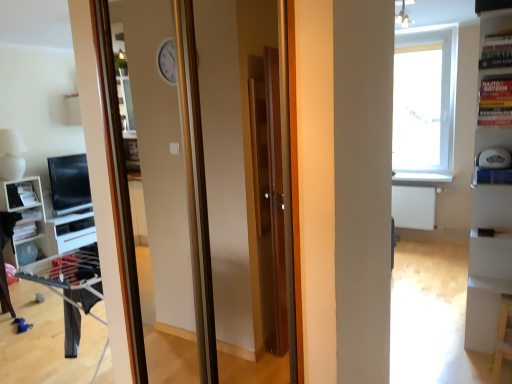
Question: Is white glossy shelf at left positioned with its back to white glossy bookshelf at right?

Choices:
 (A) yes
 (B) no

Answer: (B)

Question: Considering the relative sizes of white glossy shelf at left and white glossy bookshelf at right in the image provided, is white glossy shelf at left smaller than white glossy bookshelf at right?

Choices:
 (A) no
 (B) yes

Answer: (B)

Question: Considering the relative sizes of white glossy shelf at left and white glossy bookshelf at right in the image provided, is white glossy shelf at left wider than white glossy bookshelf at right?

Choices:
 (A) no
 (B) yes

Answer: (A)

Question: From the image's perspective, is white glossy shelf at left over white glossy bookshelf at right?

Choices:
 (A) no
 (B) yes

Answer: (A)

Question: Does white glossy shelf at left appear on the left side of white glossy bookshelf at right?

Choices:
 (A) yes
 (B) no

Answer: (A)

Question: Relative to white glossy shelf at left, is white glossy bookshelf at right in front or behind?

Choices:
 (A) front
 (B) behind

Answer: (A)

Question: Considering the positions of point (494, 114) and point (31, 226), is point (494, 114) closer or farther from the camera than point (31, 226)?

Choices:
 (A) farther
 (B) closer

Answer: (B)

Question: From a real-world perspective, relative to white glossy shelf at left, is white glossy bookshelf at right vertically above or below?

Choices:
 (A) above
 (B) below

Answer: (A)

Question: From the image's perspective, is white glossy bookshelf at right above or below white glossy shelf at left?

Choices:
 (A) above
 (B) below

Answer: (A)

Question: Visually, is matte black monitor at left positioned to the left or to the right of white glossy bookshelf at right?

Choices:
 (A) left
 (B) right

Answer: (A)

Question: From a real-world perspective, relative to white glossy bookshelf at right, is matte black monitor at left vertically above or below?

Choices:
 (A) below
 (B) above

Answer: (A)

Question: Considering the positions of matte black monitor at left and white glossy bookshelf at right in the image, is matte black monitor at left taller or shorter than white glossy bookshelf at right?

Choices:
 (A) tall
 (B) short

Answer: (B)

Question: In the image, is matte black monitor at left positioned in front of or behind white glossy bookshelf at right?

Choices:
 (A) front
 (B) behind

Answer: (B)

Question: From their relative heights in the image, would you say white glossy shelf at left is taller or shorter than transparent glass window at upper right?

Choices:
 (A) tall
 (B) short

Answer: (B)

Question: From the image's perspective, is white glossy shelf at left positioned above or below transparent glass window at upper right?

Choices:
 (A) below
 (B) above

Answer: (A)